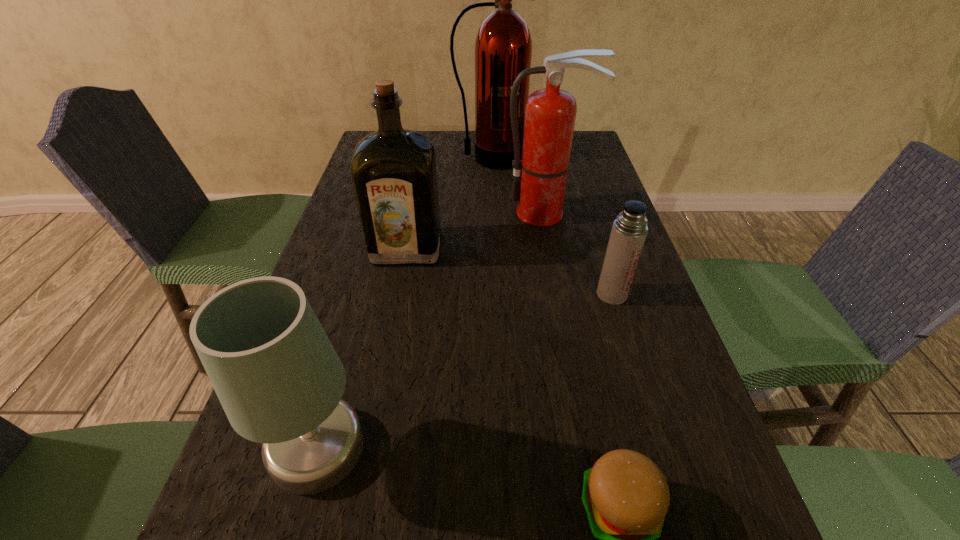
Where is `vacant area that satisfies the following two spatial constraints: 1. with the handle and hose on the second shortest object; 2. on the right side of the fifth nearest object`? This screenshot has width=960, height=540. vacant area that satisfies the following two spatial constraints: 1. with the handle and hose on the second shortest object; 2. on the right side of the fifth nearest object is located at coordinates (562, 294).

At what (x,y) coordinates should I click in order to perform the action: click on free spot that satisfies the following two spatial constraints: 1. with the handle and hose on the shorter fire extinguisher; 2. on the base of the lampshade. Please return your answer as a coordinate pair (x, y). Looking at the image, I should click on (591, 447).

Locate an element on the screen. The image size is (960, 540). vacant space that satisfies the following two spatial constraints: 1. with the handle and hose on the fifth nearest object; 2. on the base of the lampshade is located at coordinates (591, 447).

The height and width of the screenshot is (540, 960). I want to click on blank area in the image that satisfies the following two spatial constraints: 1. on the label of the liquor; 2. on the base of the lampshade, so click(370, 447).

Find the location of a particular element. vacant space that satisfies the following two spatial constraints: 1. on the front-facing side of the taller fire extinguisher; 2. on the base of the lampshade is located at coordinates (500, 447).

At what (x,y) coordinates should I click in order to perform the action: click on free location that satisfies the following two spatial constraints: 1. with the handle and hose on the second shortest object; 2. on the right side of the nearer fire extinguisher. Please return your answer as a coordinate pair (x, y). Looking at the image, I should click on (562, 294).